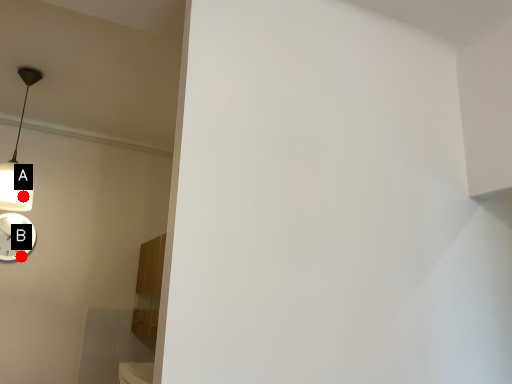
Question: Two points are circled on the image, labeled by A and B beside each circle. Which point is further to the camera?

Choices:
 (A) A is further
 (B) B is further

Answer: (B)